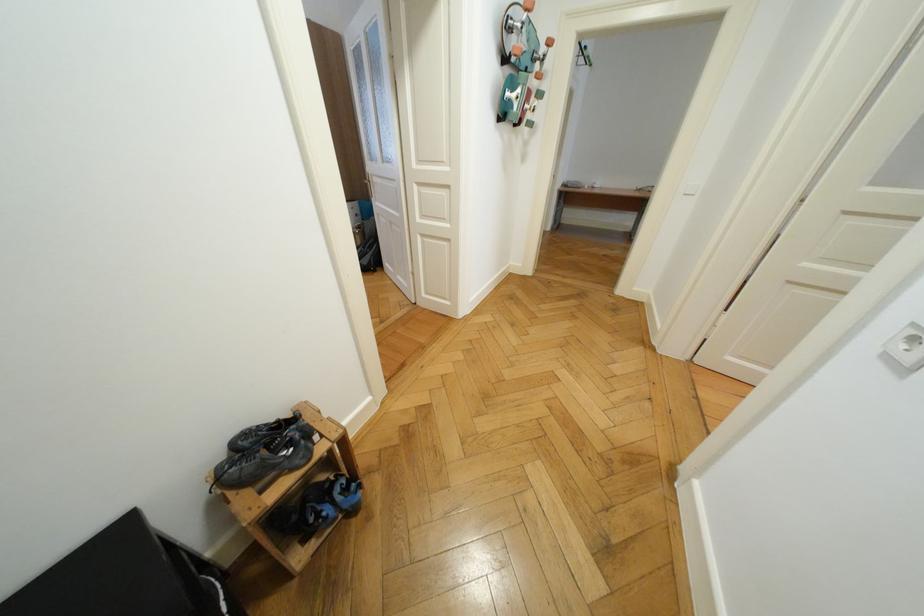
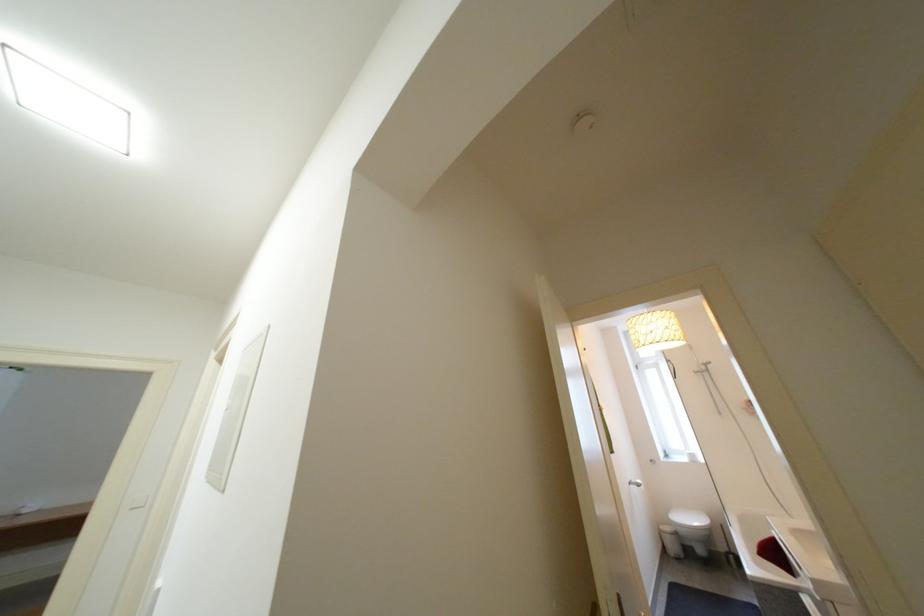
First-person continuous shooting, in which direction is the camera rotating?

The camera rotated toward right-up.